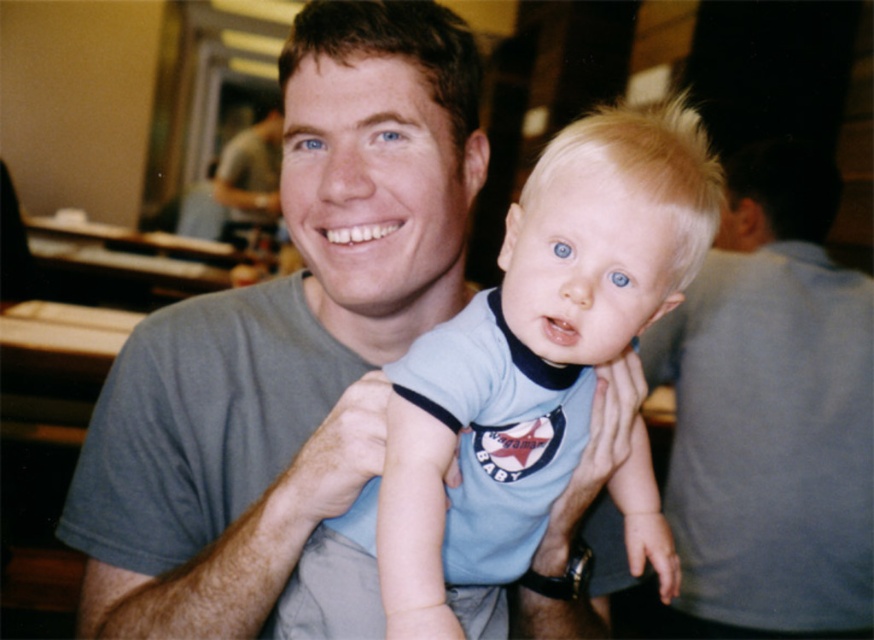
You are a photographer who wants to ensure both the gray cotton shirt at center and the light blue cotton shirt at center are clearly visible in the photo. Since the background is blurred, which shirt should you focus on to ensure the larger one is sharp?

The gray cotton shirt at center has a larger width than the light blue cotton shirt at center, so you should focus on the gray cotton shirt at center to ensure the larger one is sharp.

You are a photographer who wants to ensure both the gray cotton shirt at center and the light blue cotton shirt at center are clearly visible in the photo. Given their sizes, which shirt should you focus on to ensure both are in focus?

Since the gray cotton shirt at center is larger in size than the light blue cotton shirt at center, you should focus on the gray cotton shirt at center to ensure both are in focus.

You are a photographer who wants to ensure that both the gray cotton shirt at center and the light blue cotton shirt at center are clearly visible in your photo. Given that your camera can focus sharply on objects within a 5 inch range, will both shirts be in focus?

The gray cotton shirt at center is 5.88 inches from the light blue cotton shirt at center. Since the distance between them exceeds the camera focus range of 5 inches, only one of the shirts will be in focus at a time.